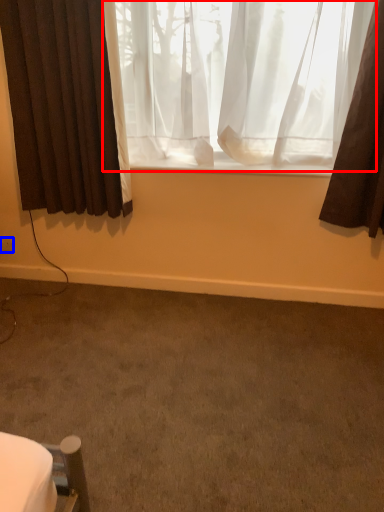
Question: Which object is closer to the camera taking this photo, curtain (highlighted by a red box) or electric outlet (highlighted by a blue box)?

Choices:
 (A) curtain
 (B) electric outlet

Answer: (A)